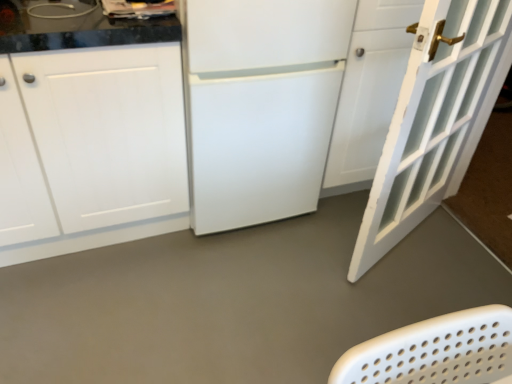
Find the location of a particular element. vacant space situated on the left part of white painted wood door at right is located at coordinates (298, 273).